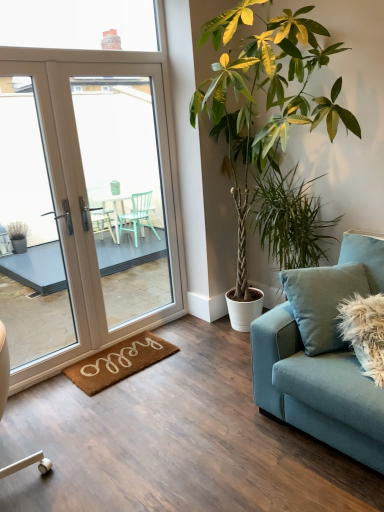
Question: Is transparent glass window at upper center located outside brown coir mat at lower left?

Choices:
 (A) yes
 (B) no

Answer: (A)

Question: Is transparent glass window at upper center closer to the viewer compared to brown coir mat at lower left?

Choices:
 (A) no
 (B) yes

Answer: (B)

Question: Is brown coir mat at lower left a part of transparent glass window at upper center?

Choices:
 (A) no
 (B) yes

Answer: (A)

Question: Does transparent glass window at upper center turn towards brown coir mat at lower left?

Choices:
 (A) no
 (B) yes

Answer: (A)

Question: Is transparent glass window at upper center taller than brown coir mat at lower left?

Choices:
 (A) no
 (B) yes

Answer: (B)

Question: Is transparent glass window at upper center behind brown coir mat at lower left?

Choices:
 (A) yes
 (B) no

Answer: (B)

Question: Is green leafy plant at center, the 2th houseplant when ordered from left to right, directly adjacent to brown coir mat at lower left?

Choices:
 (A) yes
 (B) no

Answer: (B)

Question: Is green leafy plant at center, the first houseplant in the right-to-left sequence, not near brown coir mat at lower left?

Choices:
 (A) yes
 (B) no

Answer: (A)

Question: Is brown coir mat at lower left at the back of green leafy plant at center, the first houseplant in the right-to-left sequence?

Choices:
 (A) yes
 (B) no

Answer: (B)

Question: Can you confirm if green leafy plant at center, the first houseplant in the right-to-left sequence, is taller than brown coir mat at lower left?

Choices:
 (A) yes
 (B) no

Answer: (A)

Question: Is green leafy plant at center, the first houseplant in the right-to-left sequence, positioned before brown coir mat at lower left?

Choices:
 (A) no
 (B) yes

Answer: (B)

Question: Is green leafy plant at center, the first houseplant in the right-to-left sequence, surrounding brown coir mat at lower left?

Choices:
 (A) no
 (B) yes

Answer: (A)

Question: Is teal fabric couch at right to the left of green leafy plant at center, the first houseplant viewed from the left, from the viewer's perspective?

Choices:
 (A) no
 (B) yes

Answer: (A)